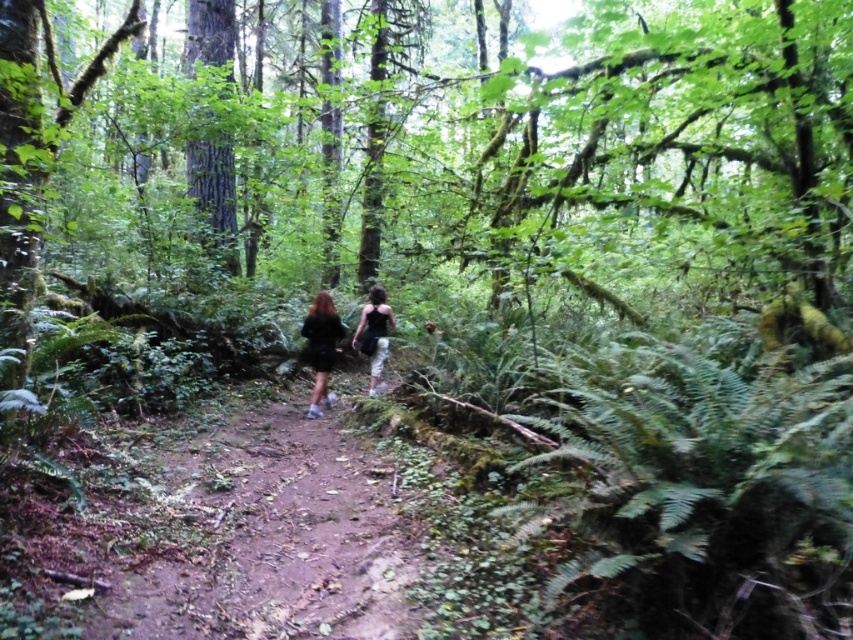
Question: Can you confirm if dirt path at center is smaller than black matte dress at center?

Choices:
 (A) no
 (B) yes

Answer: (A)

Question: Does black matte dress at center have a lesser width compared to black fabric dress at center?

Choices:
 (A) no
 (B) yes

Answer: (B)

Question: Does black matte dress at center appear over black fabric dress at center?

Choices:
 (A) yes
 (B) no

Answer: (B)

Question: Which is farther from the dirt path at center?

Choices:
 (A) black matte dress at center
 (B) black fabric dress at center

Answer: (B)

Question: Which point is closer to the camera?

Choices:
 (A) coord(328,291)
 (B) coord(361,330)

Answer: (B)

Question: Considering the real-world distances, which object is farthest from the black matte dress at center?

Choices:
 (A) dirt path at center
 (B) black fabric dress at center

Answer: (A)